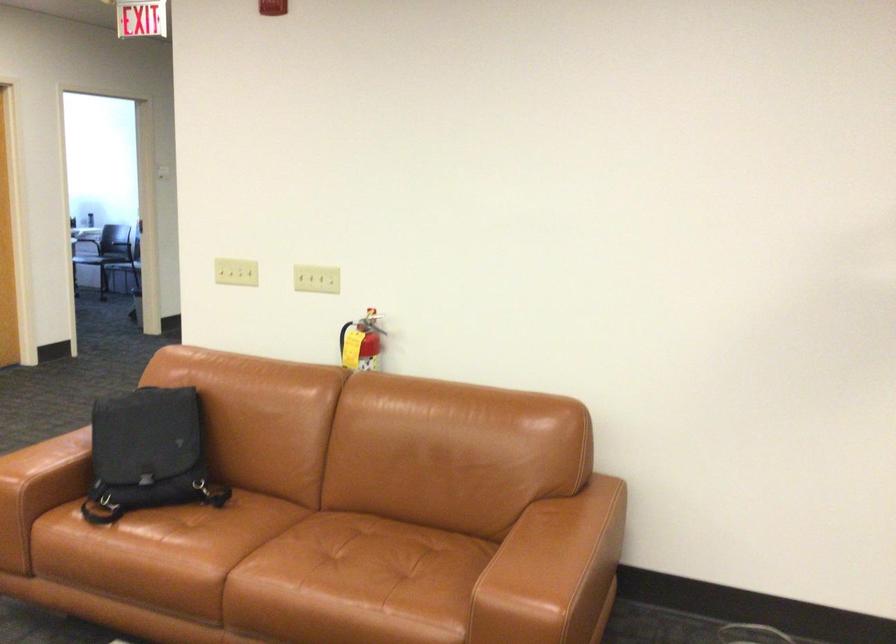
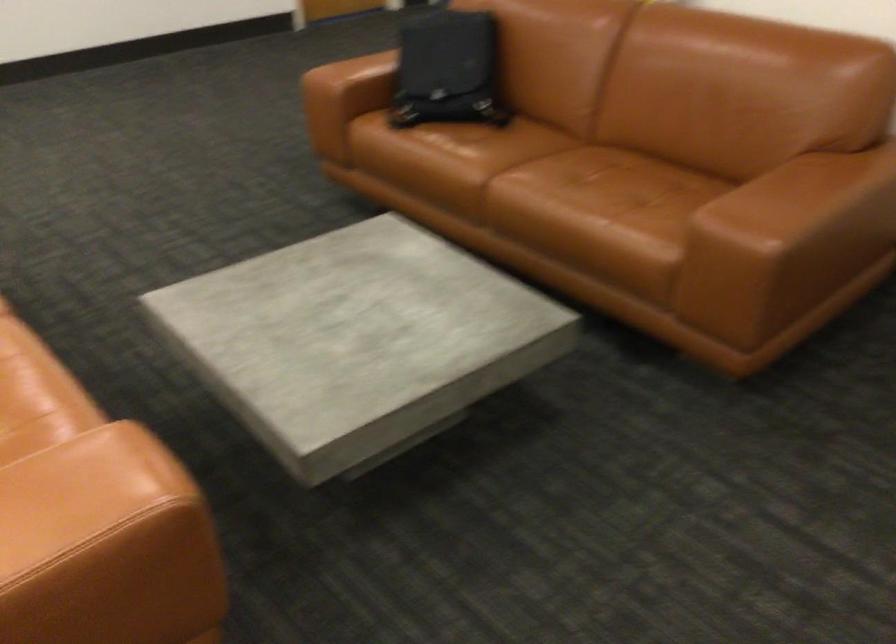
The images are taken continuously from a first-person perspective. In which direction is your viewpoint rotating?

The rotation direction of the camera is left-down.